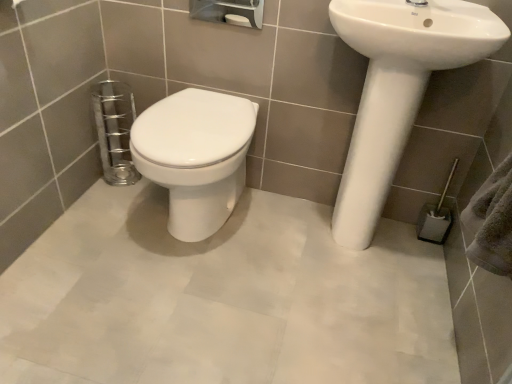
Where is `gray fabric towel bar at lower right`? This screenshot has height=384, width=512. gray fabric towel bar at lower right is located at coordinates (436, 216).

You are a GUI agent. You are given a task and a screenshot of the screen. Output one action in this format:
    pyautogui.click(x=<x>, y=<y>)
    Task: Click on the white glossy sink at right
    
    Given the screenshot: What is the action you would take?
    pyautogui.click(x=397, y=90)

Describe the element at coordinates (419, 8) in the screenshot. I see `white glossy sink at upper right` at that location.

Image resolution: width=512 pixels, height=384 pixels. I want to click on gray fabric towel bar at lower right, so click(436, 216).

Identify the location of towel bar that is below the white glossy sink at right (from the image's perspective). (436, 216).

Considering the points (379, 130) and (431, 237), which point is behind, point (379, 130) or point (431, 237)?

The point (431, 237) is more distant.

Can you confirm if white glossy sink at right is bigger than gray fabric towel bar at lower right?

Yes.

Are white glossy sink at right and gray fabric towel bar at lower right located far from each other?

No, white glossy sink at right is not far from gray fabric towel bar at lower right.

Could you tell me if white glossy bidet at center is facing gray fabric towel bar at lower right?

No, white glossy bidet at center is not oriented towards gray fabric towel bar at lower right.

Is gray fabric towel bar at lower right located within white glossy bidet at center?

No, gray fabric towel bar at lower right is not surrounded by white glossy bidet at center.

From the image's perspective, is white glossy bidet at center located above or below gray fabric towel bar at lower right?

Based on their image positions, white glossy bidet at center is located above gray fabric towel bar at lower right.

Is white glossy bidet at center oriented towards white glossy sink at right?

No, white glossy bidet at center does not turn towards white glossy sink at right.

From a real-world perspective, which is physically above, white glossy bidet at center or white glossy sink at right?

white glossy sink at right, from a real-world perspective.

Is white glossy bidet at center bigger or smaller than white glossy sink at right?

Considering their sizes, white glossy bidet at center takes up less space than white glossy sink at right.

Does white glossy bidet at center have a lesser height compared to white glossy sink at right?

Correct, white glossy bidet at center is not as tall as white glossy sink at right.

Is white glossy bidet at center at the left side of white glossy sink at upper right?

Yes, white glossy bidet at center is to the left of white glossy sink at upper right.

Is the position of white glossy bidet at center more distant than that of white glossy sink at upper right?

That is True.

Consider the image. From the image's perspective, is white glossy bidet at center located beneath white glossy sink at upper right?

Yes, from the image's perspective, white glossy bidet at center is below white glossy sink at upper right.

Which of these two, white glossy bidet at center or white glossy sink at upper right, is smaller?

With smaller size is white glossy sink at upper right.

Are white glossy sink at upper right and gray fabric towel bar at lower right making contact?

No.

Can you tell me how much white glossy sink at upper right and gray fabric towel bar at lower right differ in facing direction?

The facing directions of white glossy sink at upper right and gray fabric towel bar at lower right are 0.000433 degrees apart.

In the image, is white glossy sink at upper right positioned in front of or behind gray fabric towel bar at lower right?

Visually, white glossy sink at upper right is located in front of gray fabric towel bar at lower right.

Is white glossy sink at upper right facing towards gray fabric towel bar at lower right?

No.

Is white glossy sink at right bigger or smaller than white glossy sink at upper right?

white glossy sink at right is bigger than white glossy sink at upper right.

Which is less distant, [415,60] or [425,8]?

Point [415,60] is positioned closer to the camera compared to point [425,8].

This screenshot has width=512, height=384. What are the coordinates of `sink in front of the white glossy sink at upper right` in the screenshot? It's located at (397, 90).

Which is more to the left, white glossy sink at right or white glossy sink at upper right?

white glossy sink at right is more to the left.

Looking at this image, from the image's perspective, which is above, white glossy sink at upper right or white glossy bidet at center?

white glossy sink at upper right, from the image's perspective.

Is white glossy sink at upper right facing towards white glossy bidet at center?

No, white glossy sink at upper right is not facing towards white glossy bidet at center.

Between white glossy sink at upper right and white glossy bidet at center, which one has more height?

With more height is white glossy bidet at center.

Which is more to the right, white glossy sink at upper right or white glossy bidet at center?

Positioned to the right is white glossy sink at upper right.

At what (x,y) coordinates should I click in order to perform the action: click on towel bar behind the white glossy sink at right. Please return your answer as a coordinate pair (x, y). Image resolution: width=512 pixels, height=384 pixels. Looking at the image, I should click on (436, 216).

In the image, there is a white glossy bidet at center. Where is `towel bar below it (from the image's perspective)`? towel bar below it (from the image's perspective) is located at coordinates (436, 216).

Based on their spatial positions, is white glossy bidet at center or white glossy sink at upper right further from gray fabric towel bar at lower right?

white glossy bidet at center is positioned further to the anchor gray fabric towel bar at lower right.

Considering their positions, is gray fabric towel bar at lower right positioned closer to white glossy bidet at center than white glossy sink at right?

Among the two, white glossy sink at right is located nearer to white glossy bidet at center.

Estimate the real-world distances between objects in this image. Which object is further from white glossy sink at upper right, gray fabric towel bar at lower right or white glossy bidet at center?

Among the two, white glossy bidet at center is located further to white glossy sink at upper right.

Estimate the real-world distances between objects in this image. Which object is closer to gray fabric towel bar at lower right, white glossy sink at right or white glossy bidet at center?

white glossy sink at right is closer to gray fabric towel bar at lower right.

Which object lies nearer to the anchor point white glossy bidet at center, white glossy sink at right or white glossy sink at upper right?

white glossy sink at right is positioned closer to the anchor white glossy bidet at center.

Which object lies nearer to the anchor point white glossy sink at upper right, gray fabric towel bar at lower right or white glossy sink at right?

white glossy sink at right is positioned closer to the anchor white glossy sink at upper right.

From the image, which object appears to be nearer to white glossy bidet at center, white glossy sink at upper right or gray fabric towel bar at lower right?

white glossy sink at upper right lies closer to white glossy bidet at center than the other object.

Which object lies further to the anchor point white glossy bidet at center, gray fabric towel bar at lower right or white glossy sink at upper right?

gray fabric towel bar at lower right lies further to white glossy bidet at center than the other object.

This screenshot has width=512, height=384. Identify the location of sink between white glossy bidet at center and gray fabric towel bar at lower right. (397, 90).

Image resolution: width=512 pixels, height=384 pixels. Find the location of `sink between white glossy sink at upper right and gray fabric towel bar at lower right from top to bottom`. sink between white glossy sink at upper right and gray fabric towel bar at lower right from top to bottom is located at coordinates (397, 90).

The width and height of the screenshot is (512, 384). Identify the location of sink between white glossy bidet at center and white glossy sink at upper right in the horizontal direction. (397, 90).

This screenshot has height=384, width=512. Identify the location of plumbing fixture located between white glossy bidet at center and gray fabric towel bar at lower right in the left-right direction. (419, 8).